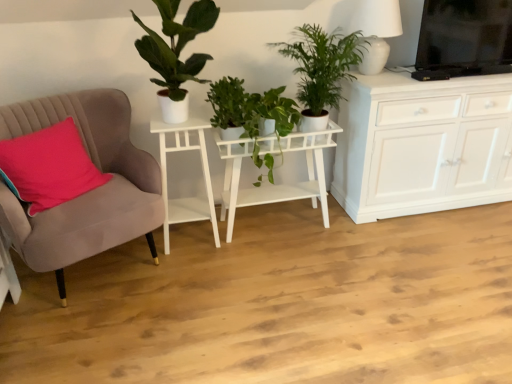
Question: Can you confirm if green matte plant at upper left, which is the first houseplant in left-to-right order, is positioned to the left of green glossy plant at center, the second houseplant viewed from the left?

Choices:
 (A) no
 (B) yes

Answer: (B)

Question: Is green matte plant at upper left, which is the first houseplant in left-to-right order, positioned far away from green glossy plant at center, the second houseplant viewed from the left?

Choices:
 (A) no
 (B) yes

Answer: (A)

Question: Is green matte plant at upper left, which is counted as the third houseplant, starting from the right, outside of green glossy plant at center, which appears as the second houseplant when viewed from the right?

Choices:
 (A) yes
 (B) no

Answer: (A)

Question: Can you confirm if green matte plant at upper left, which is the first houseplant in left-to-right order, is taller than green glossy plant at center, the second houseplant viewed from the left?

Choices:
 (A) yes
 (B) no

Answer: (A)

Question: Considering the relative sizes of green matte plant at upper left, which is the first houseplant in left-to-right order, and green glossy plant at center, the second houseplant viewed from the left, in the image provided, is green matte plant at upper left, which is the first houseplant in left-to-right order, thinner than green glossy plant at center, the second houseplant viewed from the left,?

Choices:
 (A) yes
 (B) no

Answer: (B)

Question: Is green matte plant at upper left, which is the first houseplant in left-to-right order, in contact with green glossy plant at center, which appears as the second houseplant when viewed from the right?

Choices:
 (A) yes
 (B) no

Answer: (B)

Question: Can you confirm if white matte side table at left, placed as the second table when sorted from right to left, is thinner than white ceramic lamp at upper right?

Choices:
 (A) no
 (B) yes

Answer: (A)

Question: Considering the relative sizes of white matte side table at left, which is counted as the 1th table, starting from the left, and white ceramic lamp at upper right in the image provided, is white matte side table at left, which is counted as the 1th table, starting from the left, taller than white ceramic lamp at upper right?

Choices:
 (A) yes
 (B) no

Answer: (A)

Question: From a real-world perspective, does white matte side table at left, which is counted as the 1th table, starting from the left, sit lower than white ceramic lamp at upper right?

Choices:
 (A) no
 (B) yes

Answer: (B)

Question: Is the position of white matte side table at left, placed as the second table when sorted from right to left, more distant than that of white ceramic lamp at upper right?

Choices:
 (A) no
 (B) yes

Answer: (A)

Question: From the image's perspective, is white matte side table at left, which is counted as the 1th table, starting from the left, on top of white ceramic lamp at upper right?

Choices:
 (A) no
 (B) yes

Answer: (A)

Question: From a real-world perspective, does white matte side table at left, which is counted as the 1th table, starting from the left, stand above white ceramic lamp at upper right?

Choices:
 (A) no
 (B) yes

Answer: (A)

Question: Considering the relative sizes of green glossy plant at center, the second houseplant viewed from the left, and white matte side table at left, placed as the second table when sorted from right to left, in the image provided, is green glossy plant at center, the second houseplant viewed from the left, bigger than white matte side table at left, placed as the second table when sorted from right to left,?

Choices:
 (A) yes
 (B) no

Answer: (B)